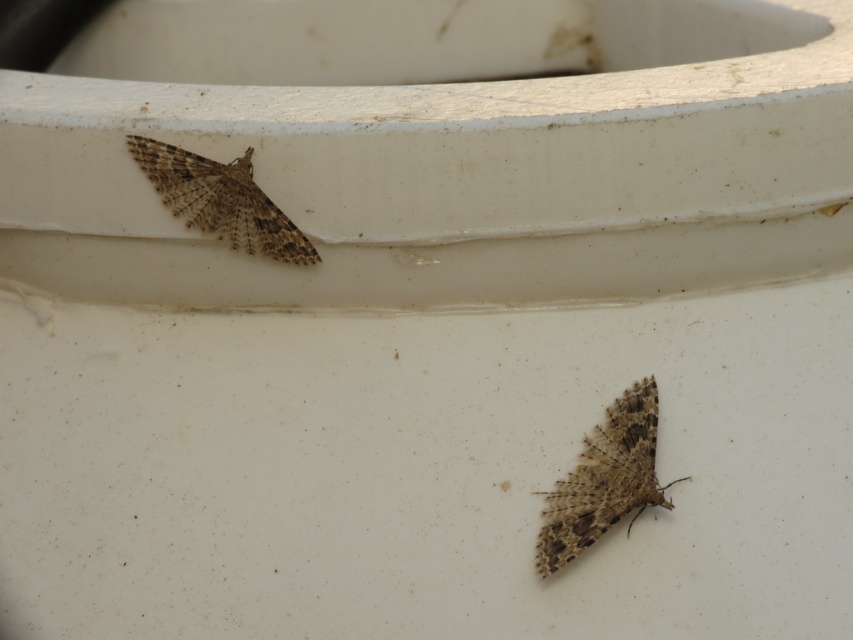
Consider the image. You are a photographer trying to capture a closeup of the moths on the white surface. You want to focus on the point closer to the front. Which point should you focus on, point (566, 492) or point (244, 193)?

Point (566, 492) is in front of point (244, 193), so you should focus on point (566, 492) to capture the moths on the white surface.

You are an entomologist examining two moths on a container surface. You need to determine their positions relative to each other. Which moth is closer to you, the brown textured moth at lower center or the brown textured moth at upper left?

The brown textured moth at lower center is closer to you because it is positioned in front of the brown textured moth at upper left.